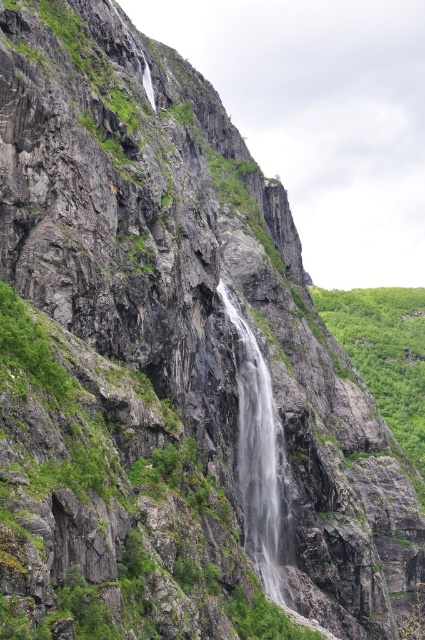
You are standing at the base of the waterfall and looking up at the cliff face. You notice two points marked on the cliff wall. One is at coordinate point (62, 451) and the other at point (274, 524). Which of these two points is closer to your current position?

Point (62, 451) is closer to the camera than point (274, 524), so the point at coordinate (62, 451) is closer to your current position.

You are a hiker who wants to cross the waterfall area. You need to step on the green mossy rock at center and the clear gray water at center. Which surface can you step on with more stability?

The green mossy rock at center is larger in size than the clear gray water at center, so stepping on the green mossy rock at center would provide more stability.